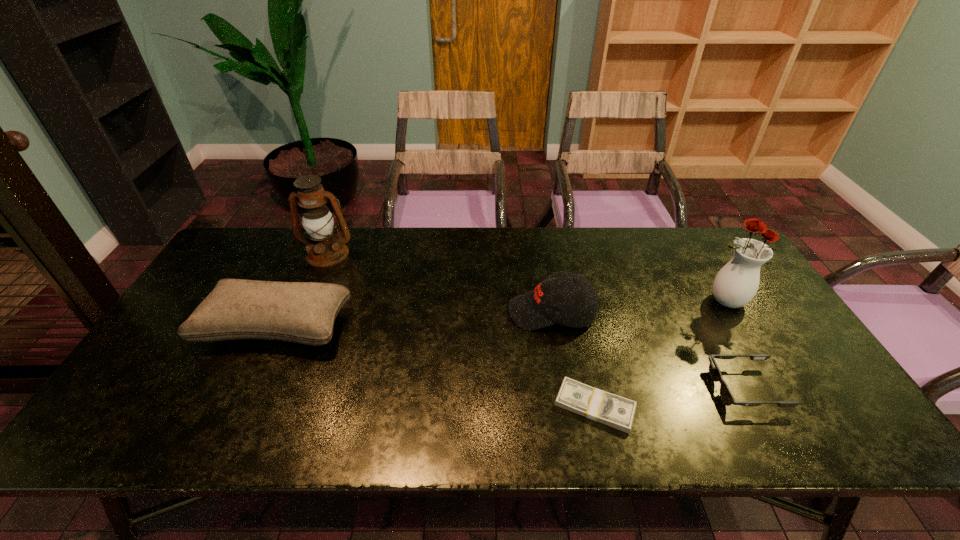
The image size is (960, 540). I want to click on the farthest object, so (x=325, y=248).

The image size is (960, 540). What are the coordinates of `vase` in the screenshot? It's located at (736, 284).

You are a GUI agent. You are given a task and a screenshot of the screen. Output one action in this format:
    pyautogui.click(x=<x>, y=<y>)
    Task: Click on the baseball cap
    The width and height of the screenshot is (960, 540).
    Given the screenshot: What is the action you would take?
    (552, 301)

You are a GUI agent. You are given a task and a screenshot of the screen. Output one action in this format:
    pyautogui.click(x=<x>, y=<y>)
    Task: Click on the cushion
    This screenshot has height=540, width=960.
    Given the screenshot: What is the action you would take?
    click(302, 312)

At what (x,y) coordinates should I click in order to perform the action: click on sunglasses. Please return your answer as a coordinate pair (x, y). This screenshot has height=540, width=960. Looking at the image, I should click on (725, 393).

Find the location of `the shortest object`. the shortest object is located at coordinates point(618,412).

At what (x,y) coordinates should I click in order to perform the action: click on blank area located on the side of the farthest object, there is a wick adjustment knob. Please return your answer as a coordinate pair (x, y). The height and width of the screenshot is (540, 960). Looking at the image, I should click on (309, 298).

I want to click on free space located on the left of the vase, so click(x=601, y=301).

This screenshot has width=960, height=540. Find the location of `vacant region located 0.270m on the front-facing side of the baseball cap`. vacant region located 0.270m on the front-facing side of the baseball cap is located at coordinates (413, 313).

The width and height of the screenshot is (960, 540). Identify the location of vacant area situated on the front-facing side of the baseball cap. (410, 313).